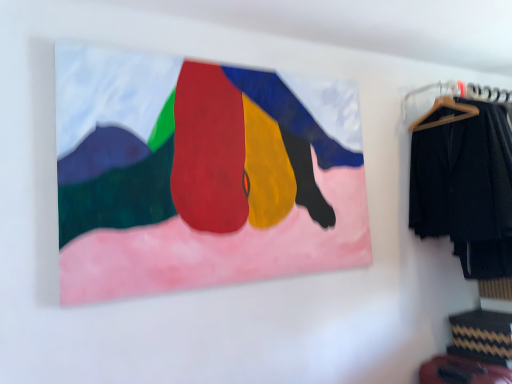
Question: Does black fabric pants at right appear on the right side of wooden hanger at upper right?

Choices:
 (A) yes
 (B) no

Answer: (A)

Question: From the image's perspective, does black fabric pants at right appear lower than wooden hanger at upper right?

Choices:
 (A) no
 (B) yes

Answer: (B)

Question: Can you confirm if black fabric pants at right is smaller than wooden hanger at upper right?

Choices:
 (A) no
 (B) yes

Answer: (A)

Question: Is black fabric pants at right further to the viewer compared to wooden hanger at upper right?

Choices:
 (A) no
 (B) yes

Answer: (A)

Question: Is black fabric pants at right facing towards wooden hanger at upper right?

Choices:
 (A) yes
 (B) no

Answer: (B)

Question: In terms of height, does wooden hanger at upper right look taller or shorter compared to matte canvas painting at upper center?

Choices:
 (A) short
 (B) tall

Answer: (A)

Question: Is wooden hanger at upper right bigger or smaller than matte canvas painting at upper center?

Choices:
 (A) big
 (B) small

Answer: (B)

Question: From the image's perspective, relative to matte canvas painting at upper center, is wooden hanger at upper right above or below?

Choices:
 (A) above
 (B) below

Answer: (A)

Question: Considering the relative positions of wooden hanger at upper right and matte canvas painting at upper center in the image provided, is wooden hanger at upper right to the left or to the right of matte canvas painting at upper center?

Choices:
 (A) left
 (B) right

Answer: (B)

Question: Based on their positions, is black fabric pants at right located to the left or right of matte canvas painting at upper center?

Choices:
 (A) left
 (B) right

Answer: (B)

Question: Is black fabric pants at right in front of or behind matte canvas painting at upper center in the image?

Choices:
 (A) behind
 (B) front

Answer: (A)

Question: Considering the positions of black fabric pants at right and matte canvas painting at upper center in the image, is black fabric pants at right bigger or smaller than matte canvas painting at upper center?

Choices:
 (A) small
 (B) big

Answer: (B)

Question: From a real-world perspective, relative to matte canvas painting at upper center, is black fabric pants at right vertically above or below?

Choices:
 (A) below
 (B) above

Answer: (A)

Question: Considering the positions of black fabric pants at right and wooden hanger at upper right in the image, is black fabric pants at right taller or shorter than wooden hanger at upper right?

Choices:
 (A) short
 (B) tall

Answer: (B)

Question: From a real-world perspective, relative to wooden hanger at upper right, is black fabric pants at right vertically above or below?

Choices:
 (A) above
 (B) below

Answer: (B)